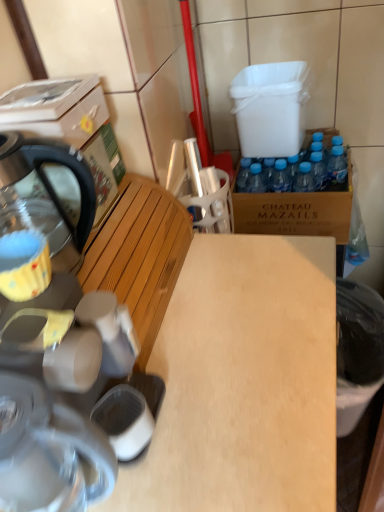
Question: Considering the relative sizes of black plastic trash can at lower right and brown cardboard box at right in the image provided, is black plastic trash can at lower right smaller than brown cardboard box at right?

Choices:
 (A) no
 (B) yes

Answer: (B)

Question: From a real-world perspective, is black plastic trash can at lower right located beneath brown cardboard box at right?

Choices:
 (A) yes
 (B) no

Answer: (A)

Question: Considering the relative sizes of black plastic trash can at lower right and brown cardboard box at right in the image provided, is black plastic trash can at lower right taller than brown cardboard box at right?

Choices:
 (A) yes
 (B) no

Answer: (A)

Question: From the image's perspective, is black plastic trash can at lower right over brown cardboard box at right?

Choices:
 (A) no
 (B) yes

Answer: (A)

Question: Is black plastic trash can at lower right turned away from brown cardboard box at right?

Choices:
 (A) no
 (B) yes

Answer: (A)

Question: Is yellow fabric coffee cup at left inside or outside of black plastic trash can at lower right?

Choices:
 (A) inside
 (B) outside

Answer: (B)

Question: From their relative heights in the image, would you say yellow fabric coffee cup at left is taller or shorter than black plastic trash can at lower right?

Choices:
 (A) short
 (B) tall

Answer: (A)

Question: Considering the positions of yellow fabric coffee cup at left and black plastic trash can at lower right in the image, is yellow fabric coffee cup at left bigger or smaller than black plastic trash can at lower right?

Choices:
 (A) big
 (B) small

Answer: (B)

Question: From the image's perspective, relative to black plastic trash can at lower right, is yellow fabric coffee cup at left above or below?

Choices:
 (A) below
 (B) above

Answer: (B)

Question: Considering the positions of stainless steel kettle at left and wooden bench at left in the image, is stainless steel kettle at left bigger or smaller than wooden bench at left?

Choices:
 (A) small
 (B) big

Answer: (A)

Question: Is stainless steel kettle at left taller or shorter than wooden bench at left?

Choices:
 (A) tall
 (B) short

Answer: (A)

Question: From the image's perspective, is stainless steel kettle at left located above or below wooden bench at left?

Choices:
 (A) above
 (B) below

Answer: (A)

Question: Choose the correct answer: Is stainless steel kettle at left inside wooden bench at left or outside it?

Choices:
 (A) outside
 (B) inside

Answer: (A)

Question: From a real-world perspective, is wooden bench at left above or below brown cardboard box at right?

Choices:
 (A) below
 (B) above

Answer: (B)

Question: Is point (119, 251) positioned closer to the camera than point (327, 198)?

Choices:
 (A) closer
 (B) farther

Answer: (A)